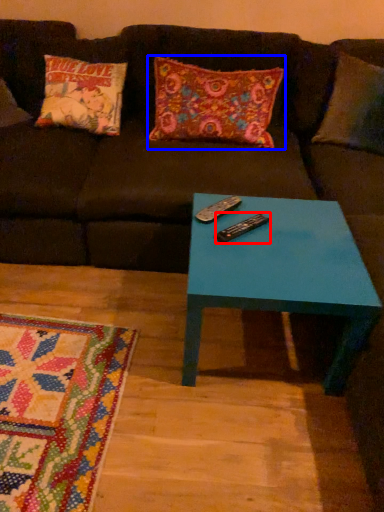
Question: Which point is closer to the camera, remote (highlighted by a red box) or pillow (highlighted by a blue box)?

Choices:
 (A) remote
 (B) pillow

Answer: (A)